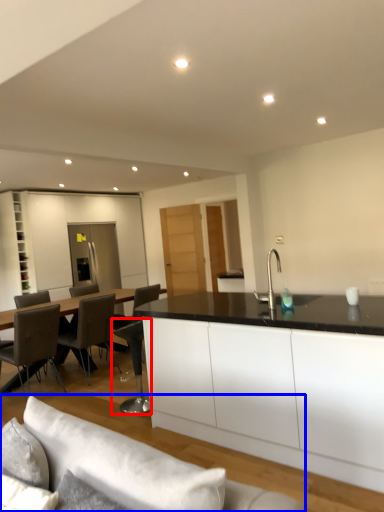
Question: Which object appears closest to the camera in this image, chair (highlighted by a red box) or studio couch (highlighted by a blue box)?

Choices:
 (A) chair
 (B) studio couch

Answer: (B)